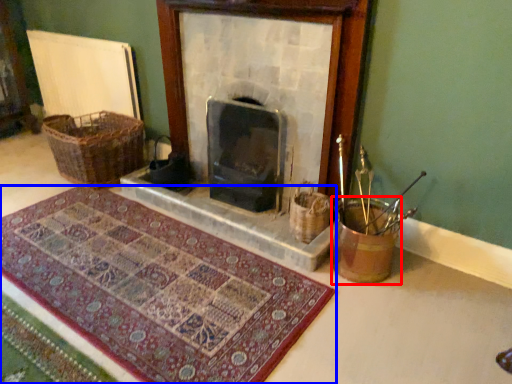
Question: Which point is further to the camera, basket container (highlighted by a red box) or mat (highlighted by a blue box)?

Choices:
 (A) basket container
 (B) mat

Answer: (A)